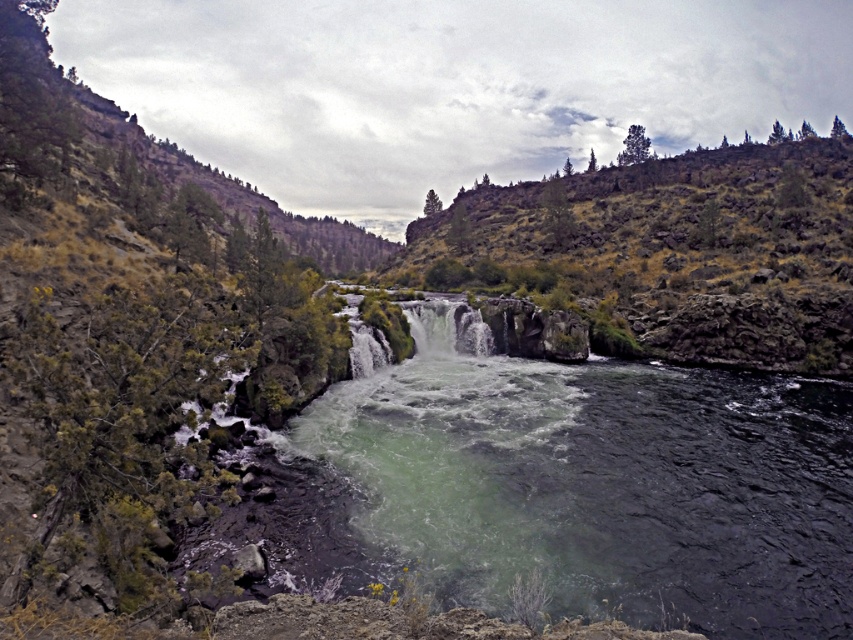
Which is behind, point (500, 397) or point (737, 236)?

Point (737, 236)

Is greenish water at center below green mossy rock at upper center?

Yes.

The width and height of the screenshot is (853, 640). I want to click on greenish water at center, so click(596, 486).

Describe the element at coordinates (670, 253) in the screenshot. I see `green mossy rock at upper center` at that location.

Can you confirm if green mossy rock at upper center is taller than white frothy water at center?

Yes.

Where is `green mossy rock at upper center`? This screenshot has height=640, width=853. green mossy rock at upper center is located at coordinates (670, 253).

Can you confirm if greenish water at center is positioned to the right of white frothy water at center?

Yes, greenish water at center is to the right of white frothy water at center.

Who is positioned more to the right, greenish water at center or white frothy water at center?

greenish water at center

Image resolution: width=853 pixels, height=640 pixels. What are the coordinates of `greenish water at center` in the screenshot? It's located at (596, 486).